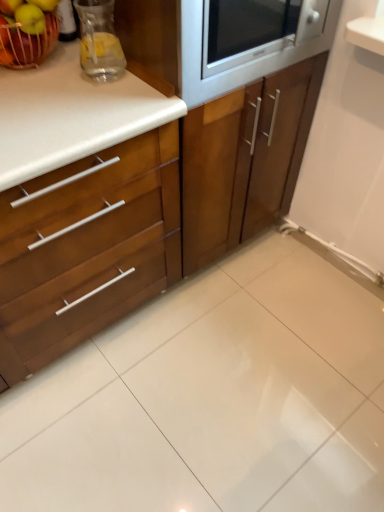
Locate an element on the screen. The image size is (384, 512). vacant area that lies in front of shiny red apple at upper left, the 2th apple in the right-to-left sequence is located at coordinates (39, 98).